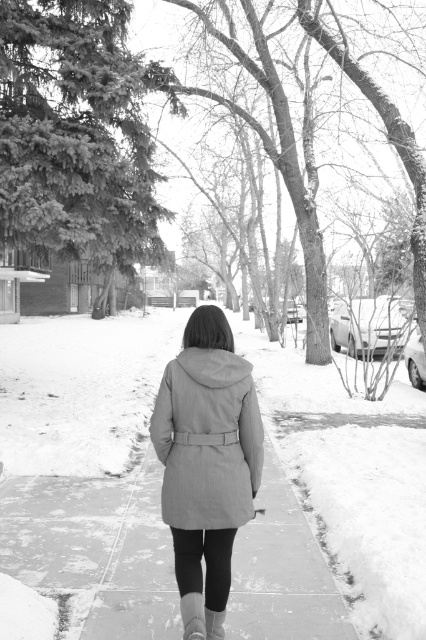
Is point (210, 422) positioned before point (209, 625)?

Yes, it is.

Who is positioned more to the left, gray wool coat at center or matte gray boot at lower center?

gray wool coat at center is more to the left.

Is point (227, 408) less distant than point (219, 628)?

Yes, point (227, 408) is closer to viewer.

You are a GUI agent. You are given a task and a screenshot of the screen. Output one action in this format:
    pyautogui.click(x=<x>, y=<y>)
    Task: Click on the gray wool coat at center
    The height and width of the screenshot is (640, 426).
    Given the screenshot: What is the action you would take?
    pyautogui.click(x=207, y=452)

Which is below, gray suede boot at center or matte gray boot at lower center?

matte gray boot at lower center is below.

What do you see at coordinates (192, 616) in the screenshot?
I see `gray suede boot at center` at bounding box center [192, 616].

Which is in front, point (186, 609) or point (222, 628)?

Point (186, 609) is more forward.

Find the location of a particular element. The image size is (426, 640). gray suede boot at center is located at coordinates (192, 616).

In the scene shown: Can you confirm if gray wool coat at center is wider than gray suede boot at center?

Indeed, gray wool coat at center has a greater width compared to gray suede boot at center.

Is point (238, 371) behind point (190, 593)?

No, (238, 371) is closer to viewer.

Identify the location of gray wool coat at center. The width and height of the screenshot is (426, 640). (207, 452).